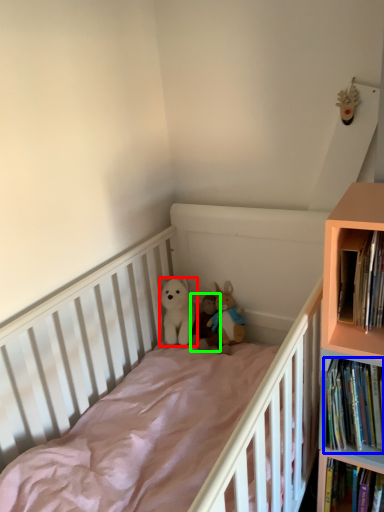
Question: Based on their relative distances, which object is farther from toy (highlighted by a red box)? Choose from book (highlighted by a blue box) and toy (highlighted by a green box).

Choices:
 (A) book
 (B) toy

Answer: (A)